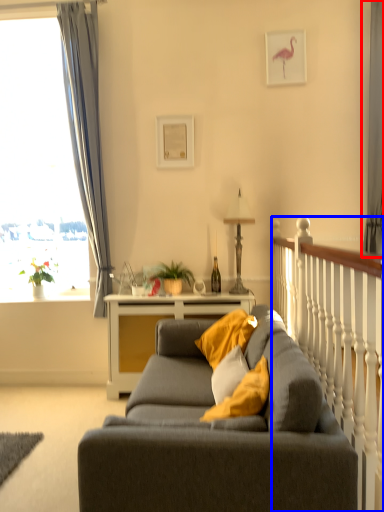
Question: Which point is closer to the camera, curtain (highlighted by a red box) or rail (highlighted by a blue box)?

Choices:
 (A) curtain
 (B) rail

Answer: (B)